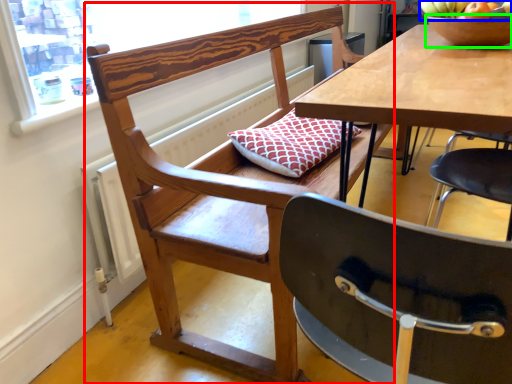
Question: Which object is the farthest from chair (highlighted by a red box)? Choose among these: fruit (highlighted by a blue box) or bowl (highlighted by a green box).

Choices:
 (A) fruit
 (B) bowl

Answer: (A)